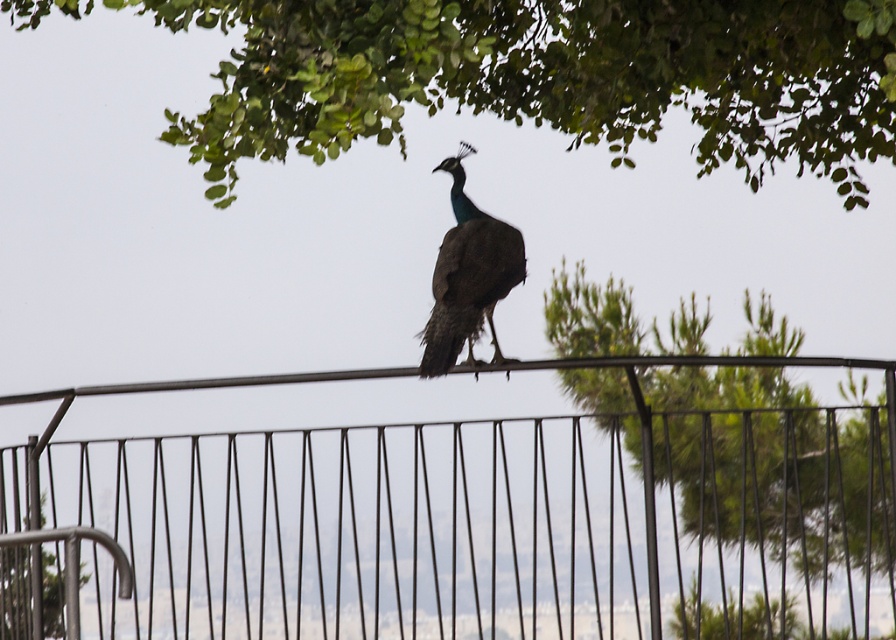
Who is positioned more to the left, green leafy tree at upper center or shiny blue peacock at center?

shiny blue peacock at center

Does green leafy tree at upper center appear over shiny blue peacock at center?

Yes, green leafy tree at upper center is above shiny blue peacock at center.

Which is in front, point (274, 8) or point (487, 314)?

Point (274, 8) is in front.

This screenshot has height=640, width=896. I want to click on green leafy tree at upper center, so click(x=549, y=76).

Is point (543, 440) more distant than point (314, 97)?

Yes, point (543, 440) is behind point (314, 97).

Who is higher up, black metal fence at center or green leafy tree at upper center?

green leafy tree at upper center is higher up.

Describe the element at coordinates (461, 522) in the screenshot. I see `black metal fence at center` at that location.

I want to click on black metal fence at center, so click(461, 522).

Which of these two, black metal fence at center or shiny blue peacock at center, stands shorter?

Standing shorter between the two is shiny blue peacock at center.

Who is more distant from viewer, (297, 584) or (461, 275)?

The point (461, 275) is behind.

Between point (93, 508) and point (490, 314), which one is positioned behind?

Point (93, 508)

Where is `black metal fence at center`? The image size is (896, 640). black metal fence at center is located at coordinates (461, 522).